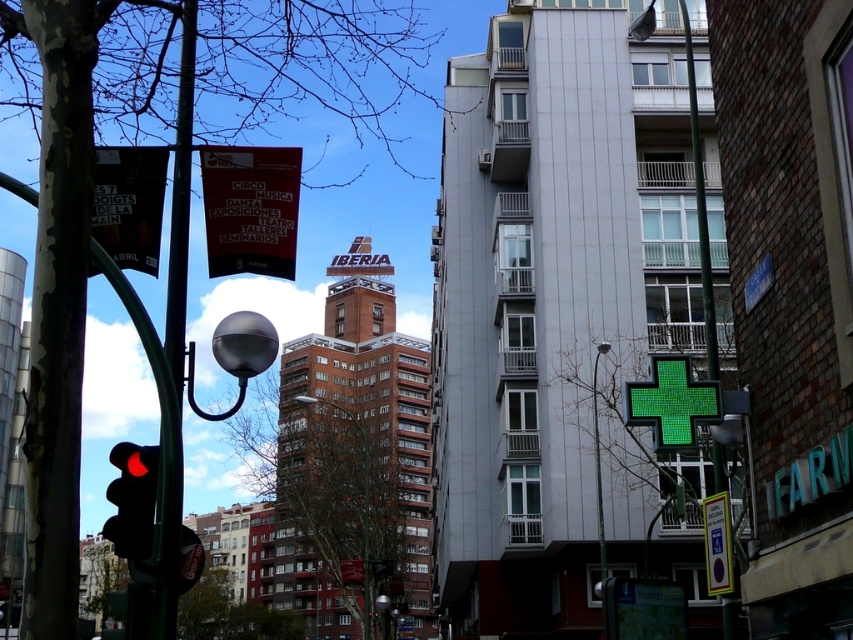
You are a city planner assessing the street layout. The green plastic sign at lower right and the brown wooden pole at center are both in the way of a new sidewalk. Since the sidewalk requires a space that can only accommodate objects with a width of 10 cm or less, will both objects fit? Explain your reasoning.

Result: The green plastic sign at lower right is thinner than the brown wooden pole at center. Since the sidewalk can only accommodate objects up to 10 cm wide, the green plastic sign at lower right might fit if its width is within 10 cm, but the brown wooden pole at center is thicker and likely exceeds the 10 cm limit. Therefore, only the green plastic sign at lower right could potentially fit, while the brown wooden pole at center would not.

You are a city planner assessing the street layout. The black glass traffic light at left and the green plastic sign at lower right are both in the foreground. Which object is wider?

The black glass traffic light at left is wider than the green plastic sign at lower right according to the description.

You are a city planner assessing the visibility of traffic lights. Given that the black glass traffic light at left is larger than the brown wooden pole at center, does this help improve its visibility for drivers?

Yes, the black glass traffic light at left has a larger size compared to the brown wooden pole at center, which likely enhances its visibility for drivers.